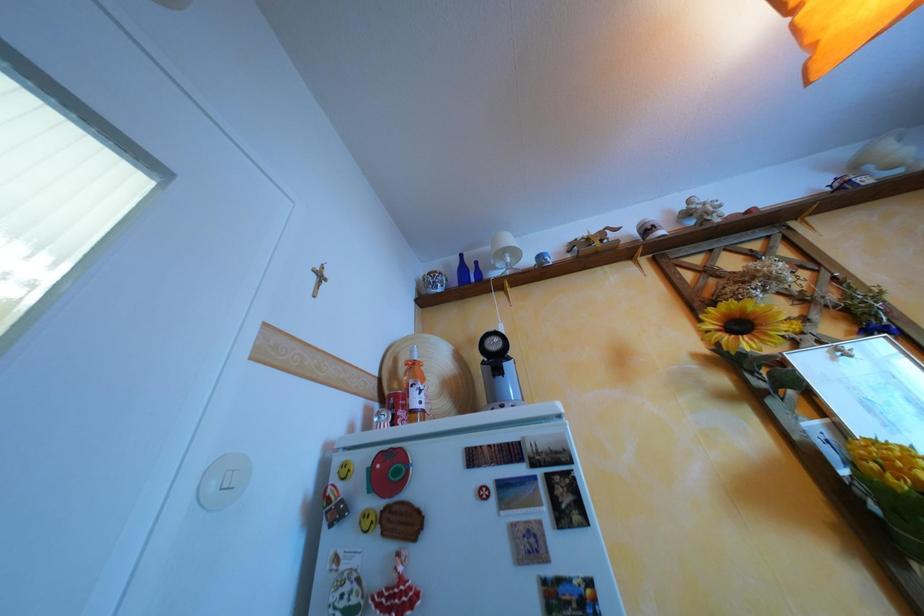
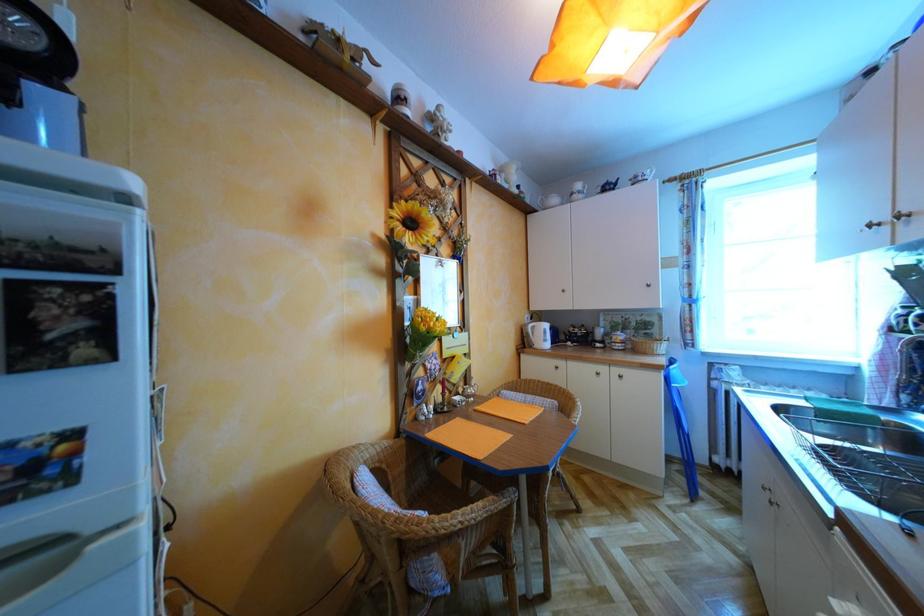
Question: The images are taken continuously from a first-person perspective. In which direction is your viewpoint rotating?

Choices:
 (A) Left
 (B) Right
 (C) Up
 (D) Down

Answer: (B)